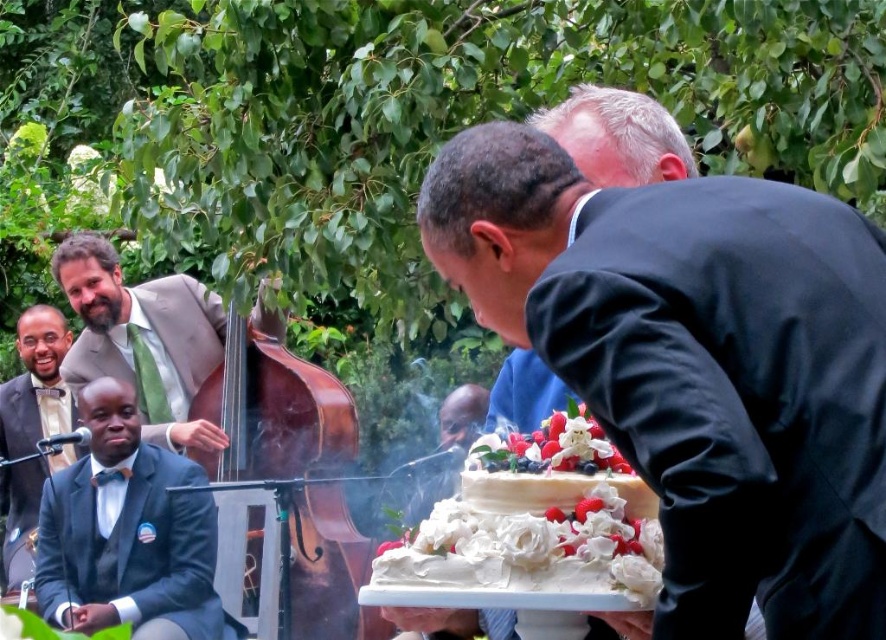
Question: Is white cream cake at center behind wooden polished cello at center?

Choices:
 (A) no
 (B) yes

Answer: (A)

Question: Which of these objects is positioned farthest from the wooden polished cello at center?

Choices:
 (A) matte green bow tie at left
 (B) light brown suit at upper left
 (C) white cream cake at center

Answer: (C)

Question: Which of the following is the farthest from the observer?

Choices:
 (A) (609, 493)
 (B) (30, 429)
 (C) (180, 627)
 (D) (783, 516)

Answer: (B)

Question: Can you confirm if light brown suit at upper left is smaller than matte green bow tie at left?

Choices:
 (A) yes
 (B) no

Answer: (B)

Question: Can you confirm if matte black suit at lower left is thinner than light brown suit at upper left?

Choices:
 (A) no
 (B) yes

Answer: (B)

Question: Which object is farther from the camera taking this photo?

Choices:
 (A) light brown suit at upper left
 (B) matte black suit at lower left
 (C) white cream cake at center
 (D) matte black suit at center

Answer: (A)